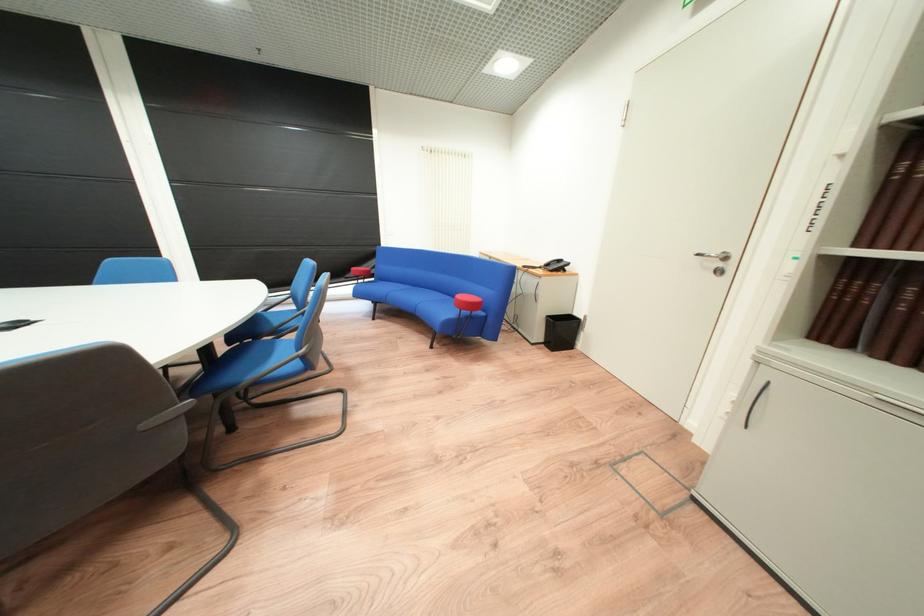
Find the location of a particular element. blue chair sitting surface is located at coordinates (265, 352).